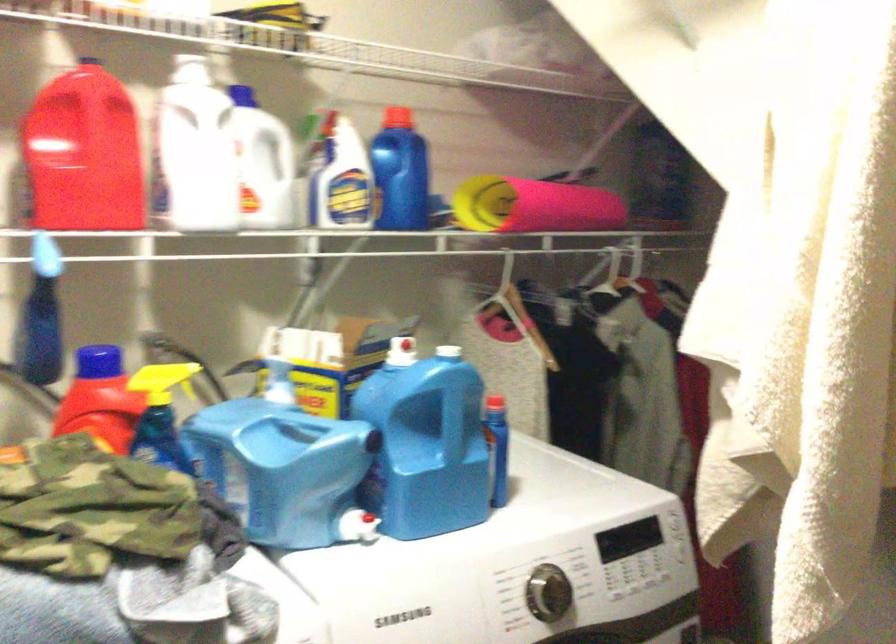
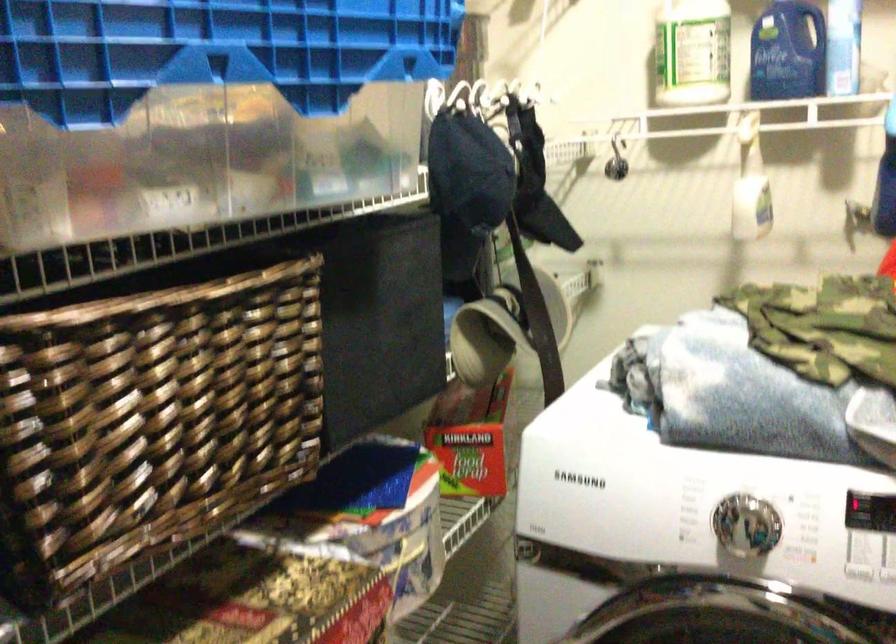
Question: The images are taken continuously from a first-person perspective. In which direction is your viewpoint rotating?

Choices:
 (A) Left
 (B) Right
 (C) Up
 (D) Down

Answer: (A)